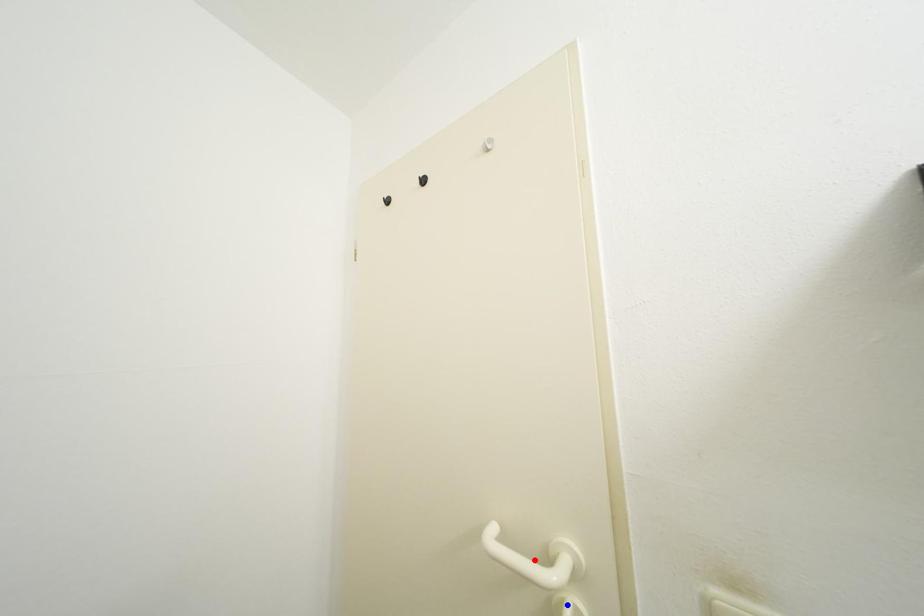
Question: Which of the two points in the image is closer to the camera?

Choices:
 (A) Blue point is closer.
 (B) Red point is closer.

Answer: (A)